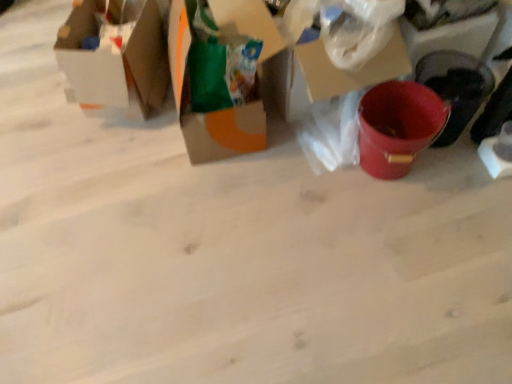
This screenshot has height=384, width=512. Identify the location of vacant space that is to the left of cardboard box at center, the 1th box when ordered from right to left. click(x=146, y=146).